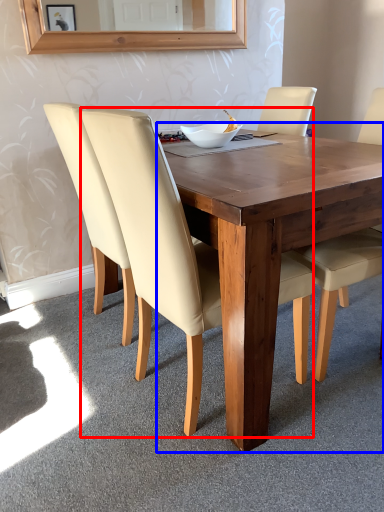
Question: Which point is closer to the camera, chair (highlighted by a red box) or round table (highlighted by a blue box)?

Choices:
 (A) chair
 (B) round table

Answer: (A)